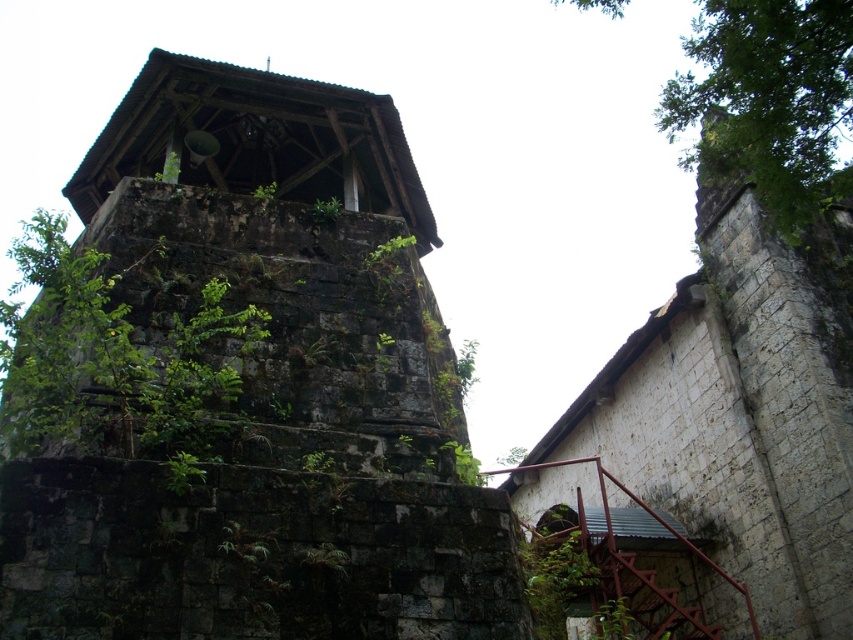
Question: Does dark stone tower at center appear over green leafy tree at upper right?

Choices:
 (A) yes
 (B) no

Answer: (B)

Question: Does dark stone tower at center lie in front of green leafy tree at upper right?

Choices:
 (A) yes
 (B) no

Answer: (A)

Question: Which point is farther to the camera?

Choices:
 (A) (276, 563)
 (B) (721, 1)

Answer: (B)

Question: Which point is farther to the camera?

Choices:
 (A) (828, 49)
 (B) (138, 273)

Answer: (B)

Question: Does dark stone tower at center have a smaller size compared to green leafy tree at upper right?

Choices:
 (A) yes
 (B) no

Answer: (A)